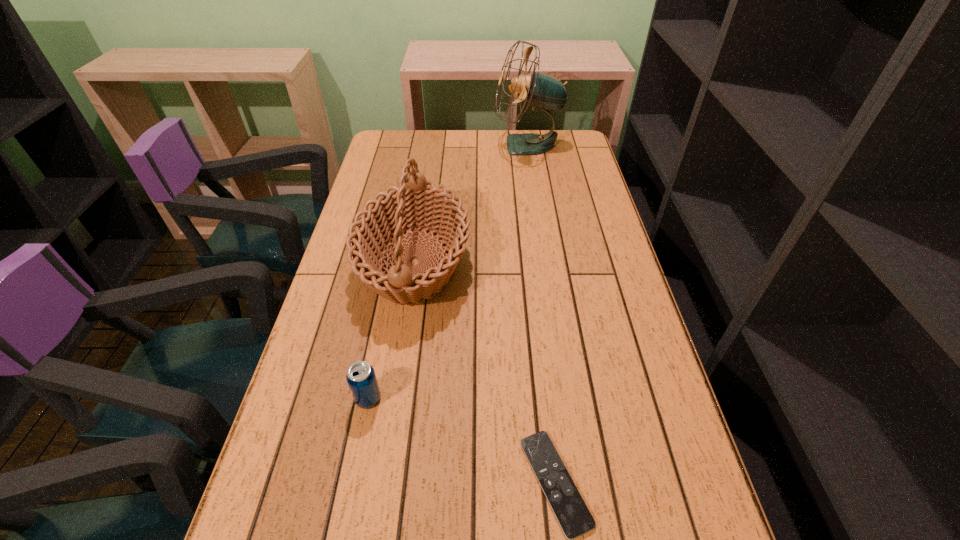
At what (x,y) coordinates should I click in order to perform the action: click on free location located 0.050m on the back of the pop soda. Please return your answer as a coordinate pair (x, y). The image size is (960, 540). Looking at the image, I should click on (374, 367).

The width and height of the screenshot is (960, 540). Identify the location of object at the far edge. (541, 91).

You are a GUI agent. You are given a task and a screenshot of the screen. Output one action in this format:
    pyautogui.click(x=<x>, y=<y>)
    Task: Click on the basket that is positioned at the left edge
    Image resolution: width=960 pixels, height=540 pixels.
    Given the screenshot: What is the action you would take?
    pyautogui.click(x=416, y=203)

Where is `pop soda at the left edge`? The width and height of the screenshot is (960, 540). pop soda at the left edge is located at coordinates (361, 378).

This screenshot has width=960, height=540. What are the coordinates of `object located at the right edge` in the screenshot? It's located at (541, 91).

Identify the location of object that is at the far right corner. (541, 91).

This screenshot has height=540, width=960. Identify the location of vacant space at the far edge of the desktop. (460, 160).

Image resolution: width=960 pixels, height=540 pixels. I want to click on free space at the right edge of the desktop, so click(572, 250).

Find the location of a particular element. Image resolution: width=960 pixels, height=540 pixels. blank space at the far right corner of the desktop is located at coordinates (544, 161).

Where is `unoccupied position between the farthest object and the second tallest object`? unoccupied position between the farthest object and the second tallest object is located at coordinates (471, 204).